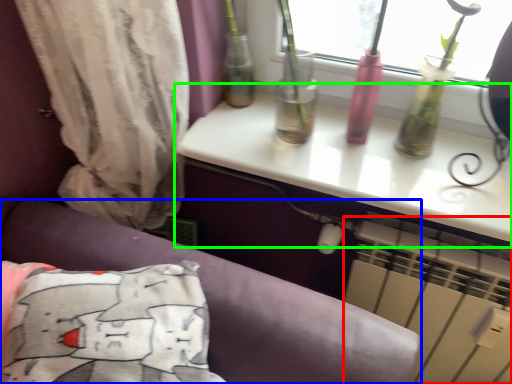
Question: Which is farther away from air conditioning (highlighted by a red box)? furniture (highlighted by a blue box) or table (highlighted by a green box)?

Choices:
 (A) furniture
 (B) table

Answer: (A)